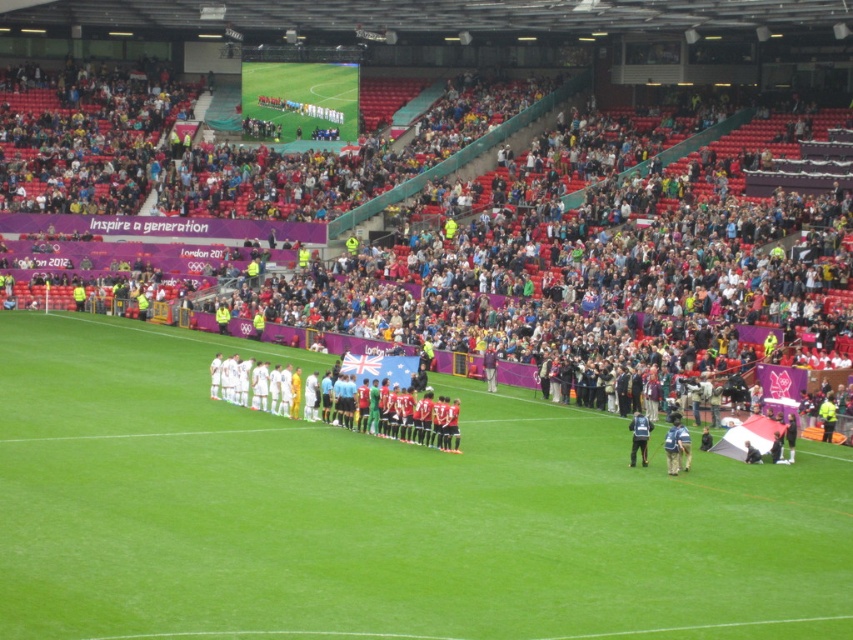
You are a photographer standing at the edge of the soccer field. You want to take a photo that includes both the green grass football field at center and the dark blue backpack at lower right. Which object should be placed to the right side in your photo?

The dark blue backpack at lower right should be placed to the right side in your photo because the green grass football field at center is positioned on the left side of it.

You are a photographer standing at the edge of the green grass football field at center and camouflage pants at center. You want to take a photo of both objects in the scene. Which object should you focus on first to ensure both are in the frame?

The green grass football field at center has a greater height compared to camouflage pants at center, so you should focus on the taller object first to ensure both are in the frame.